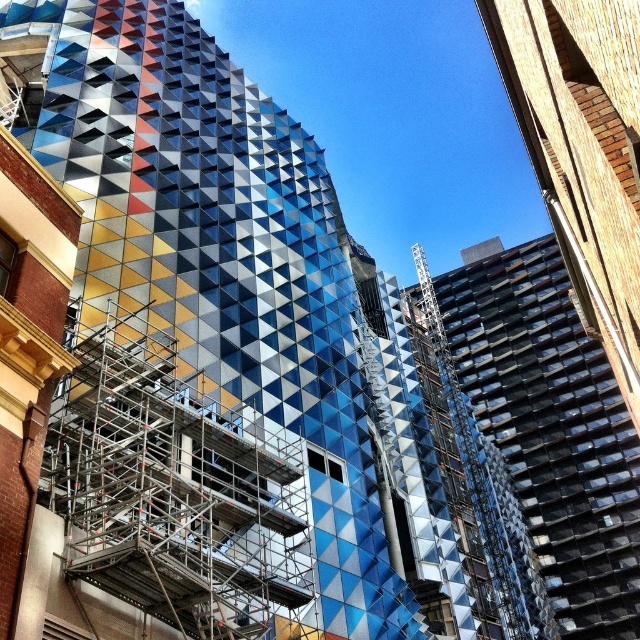
Can you confirm if metallic geometric facade at center is positioned below silver metallic scaffolding at center?

No.

Who is taller, metallic geometric facade at center or silver metallic scaffolding at center?

With more height is metallic geometric facade at center.

The width and height of the screenshot is (640, 640). Find the location of `metallic geometric facade at center`. metallic geometric facade at center is located at coordinates click(x=244, y=284).